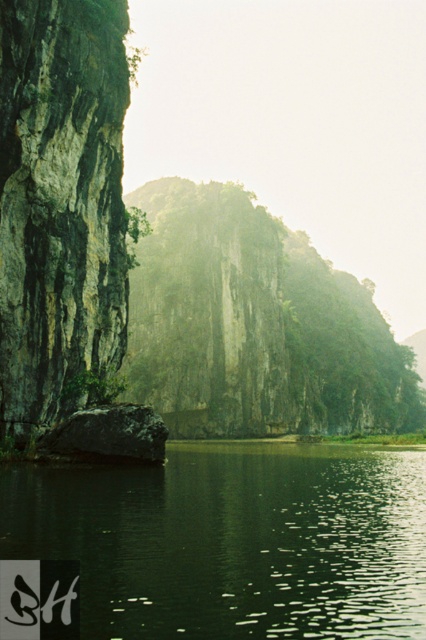
Question: Can you confirm if green rough rock at center is positioned below green rough rock at left?

Choices:
 (A) yes
 (B) no

Answer: (A)

Question: Considering the real-world distances, which object is closest to the green smooth water at center?

Choices:
 (A) green rough rock at left
 (B) green rough rock at center

Answer: (A)

Question: Is green smooth water at center smaller than green rough rock at left?

Choices:
 (A) no
 (B) yes

Answer: (A)

Question: Which object is positioned farthest from the green smooth water at center?

Choices:
 (A) green rough rock at left
 (B) green rough rock at center

Answer: (B)

Question: Which object is positioned closest to the green rough rock at center?

Choices:
 (A) green smooth water at center
 (B) green rough rock at left

Answer: (B)

Question: In this image, where is green smooth water at center located relative to green rough rock at left?

Choices:
 (A) right
 (B) left

Answer: (A)